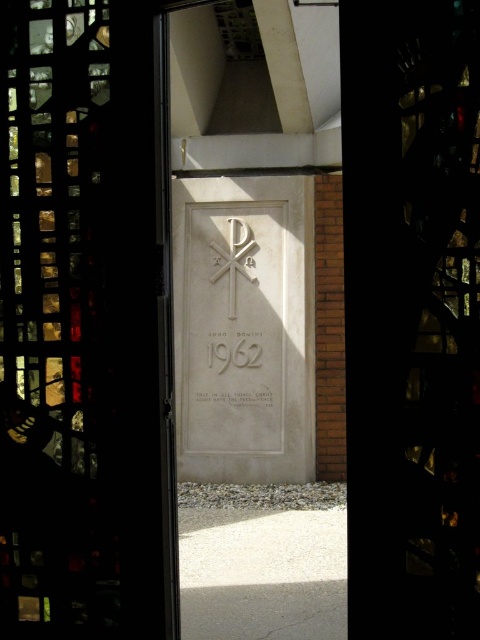
You are standing in front of a stone wall with a stained glass window on the left. You see both the white stone plaque at center and the white stone cross at center. Which object is closer to you?

The white stone plaque at center is closer to the viewer than the white stone cross at center.

You are standing 1.72 meters away from the point labeled as point (x=386, y=38). Can you reach this point with your outstretched hand?

The distance between you and point (x=386, y=38) is 1.72 meters. Since the average human arm length is about 0.7 meters, you cannot reach it with your outstretched hand.

You are standing in front of the stone plaque with the stained glass window. You want to take a photo of the white stone cross at center without the transparent stained glass at center blocking it. Is this possible?

The transparent stained glass at center is in front of the white stone cross at center, so taking a photo of the white stone cross at center without the transparent stained glass at center blocking it would require moving the stained glass, which isn